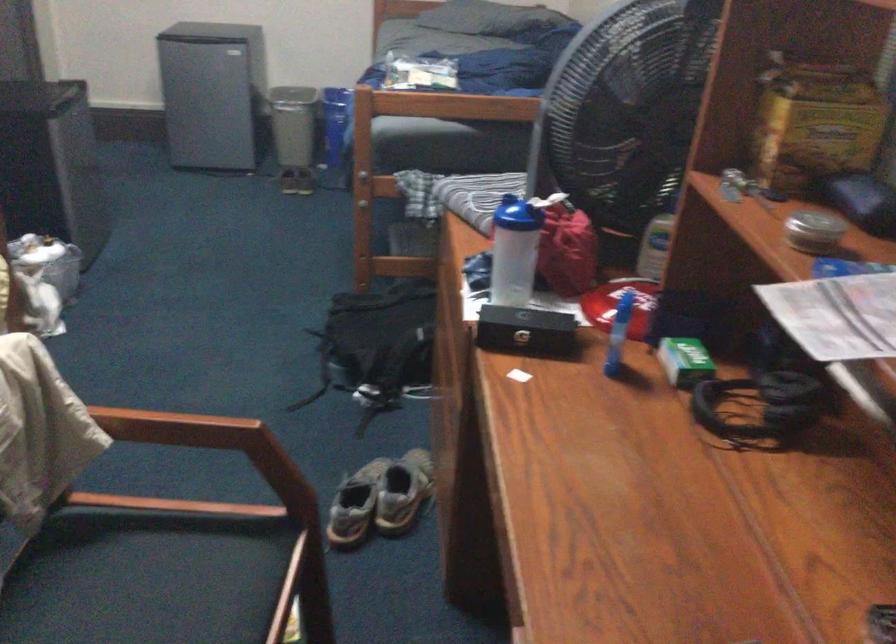
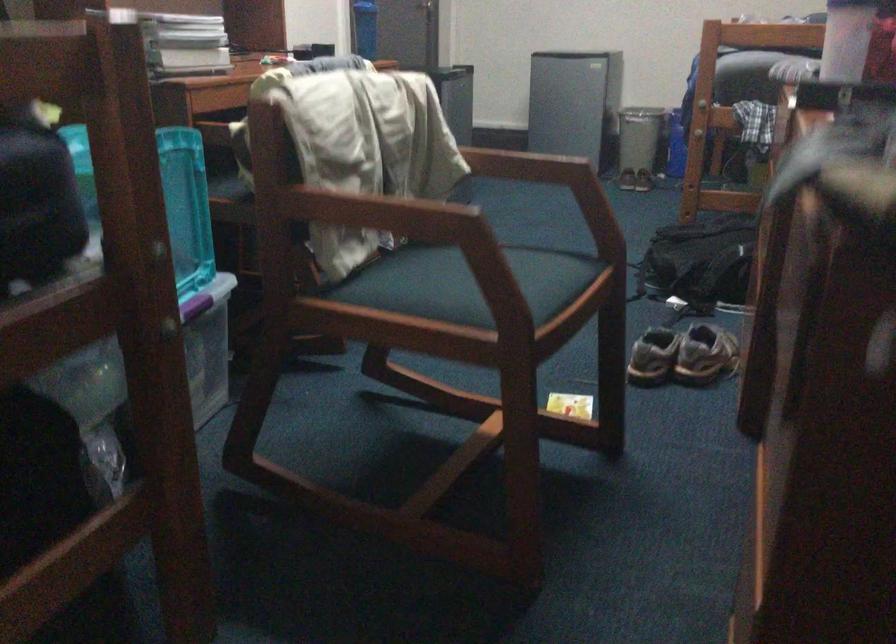
In the second image, find the point that corresponds to the point at 380,351 in the first image.

(701, 260)